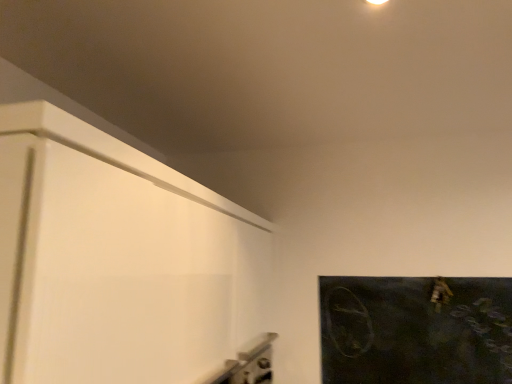
Question: Should I look upward or downward to see dark matte board at right?

Choices:
 (A) up
 (B) down

Answer: (B)